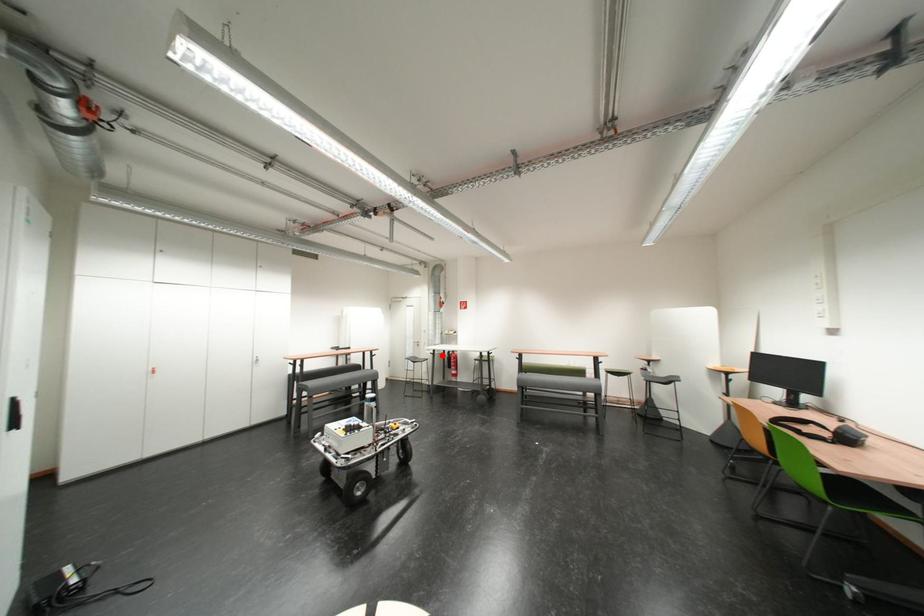
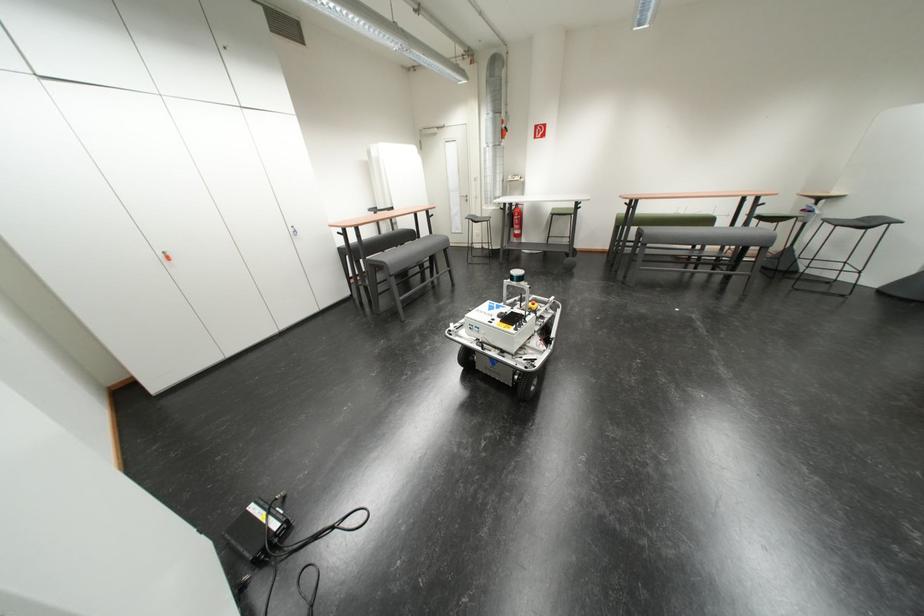
Locate, in the second image, the point that corresponds to the highlighted location in the first image.

(512, 211)